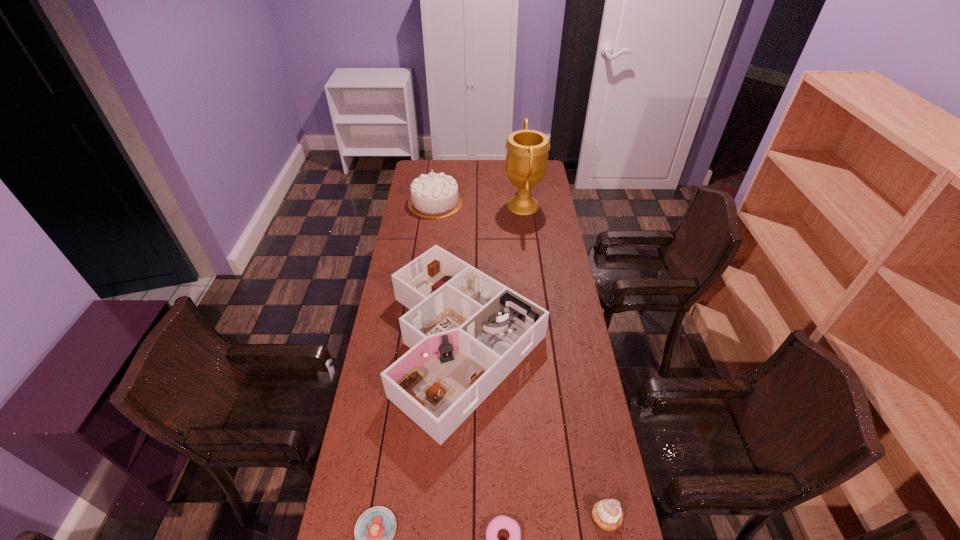
Locate an element on the screen. Image resolution: width=960 pixels, height=540 pixels. free space between the third farthest object and the fourth tallest object is located at coordinates (537, 429).

Locate an element on the screen. object that is the fifth closest one to the second pastry from left to right is located at coordinates (433, 195).

Where is `the fifth closest object relative to the tallest object`? This screenshot has width=960, height=540. the fifth closest object relative to the tallest object is located at coordinates (375, 528).

Select which pastry is the closest to the second pastry from right to left. Please provide its 2D coordinates. Your answer should be formatted as a tuple, i.e. [(x, y)], where the tuple contains the x and y coordinates of a point satisfying the conditions above.

[(607, 514)]

Identify which pastry is located as the nearest to the tallest pastry. Please provide its 2D coordinates. Your answer should be formatted as a tuple, i.e. [(x, y)], where the tuple contains the x and y coordinates of a point satisfying the conditions above.

[(500, 522)]

Where is `free location that satisfies the following two spatial constraints: 1. on the engravings side of the tallest object; 2. on the front side of the dollhouse`? The height and width of the screenshot is (540, 960). free location that satisfies the following two spatial constraints: 1. on the engravings side of the tallest object; 2. on the front side of the dollhouse is located at coordinates (540, 342).